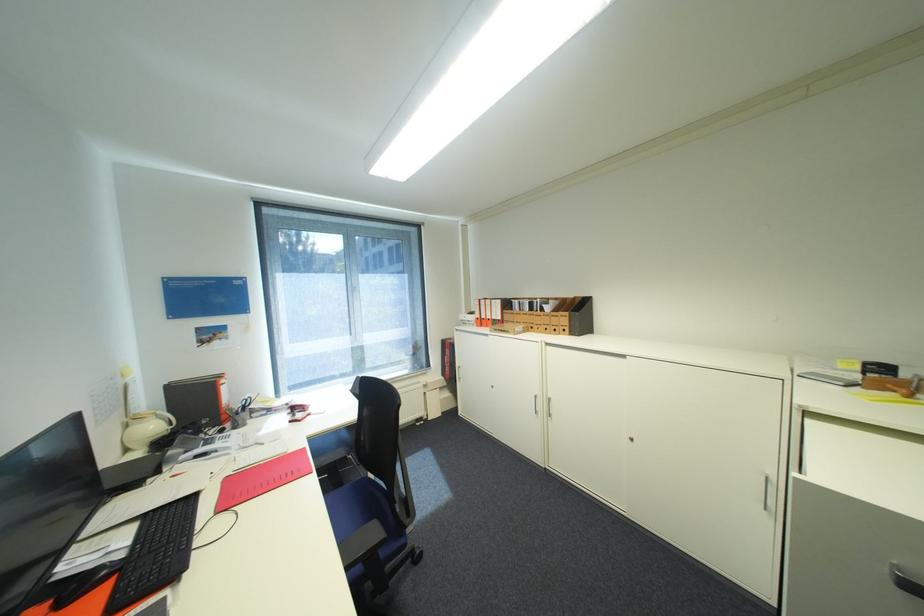
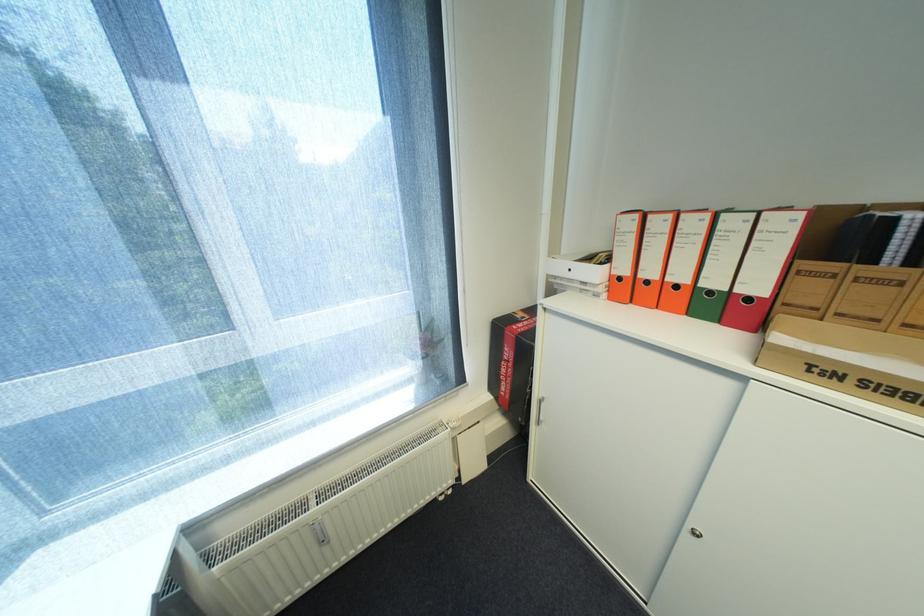
Locate, in the second image, the point that corresponds to point (496, 320) in the first image.

(685, 286)